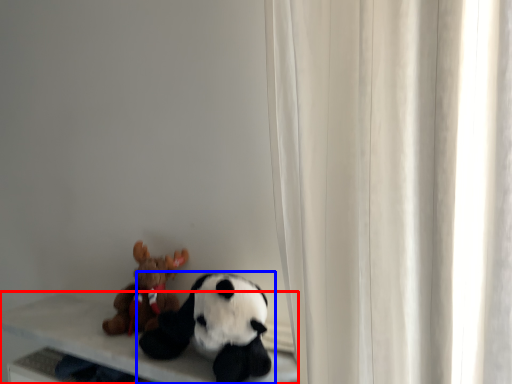
Question: Which object is closer to the camera taking this photo, table (highlighted by a red box) or toy (highlighted by a blue box)?

Choices:
 (A) table
 (B) toy

Answer: (B)